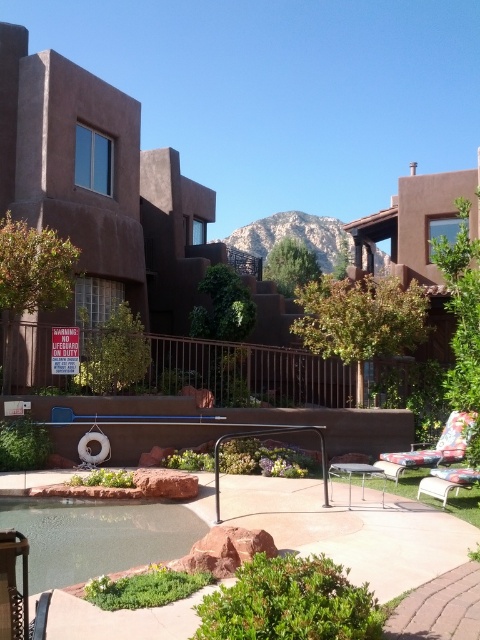
Question: Can you confirm if clear glass pool at center is bigger than white plastic chair at lower right?

Choices:
 (A) yes
 (B) no

Answer: (A)

Question: Does floral fabric lounge chair at lower right lie behind white plastic chair at lower right?

Choices:
 (A) yes
 (B) no

Answer: (B)

Question: Which is nearer to the clear glass pool at center?

Choices:
 (A) white plastic chair at lower right
 (B) floral fabric lounge chair at lower right

Answer: (A)

Question: Which point is farther from the camera taking this photo?

Choices:
 (A) [433, 451]
 (B) [456, 477]

Answer: (A)

Question: Can you confirm if floral fabric lounge chair at lower right is thinner than white plastic chair at lower right?

Choices:
 (A) yes
 (B) no

Answer: (B)

Question: Among these points, which one is farthest from the camera?

Choices:
 (A) (190, 522)
 (B) (433, 452)
 (C) (455, 484)

Answer: (B)